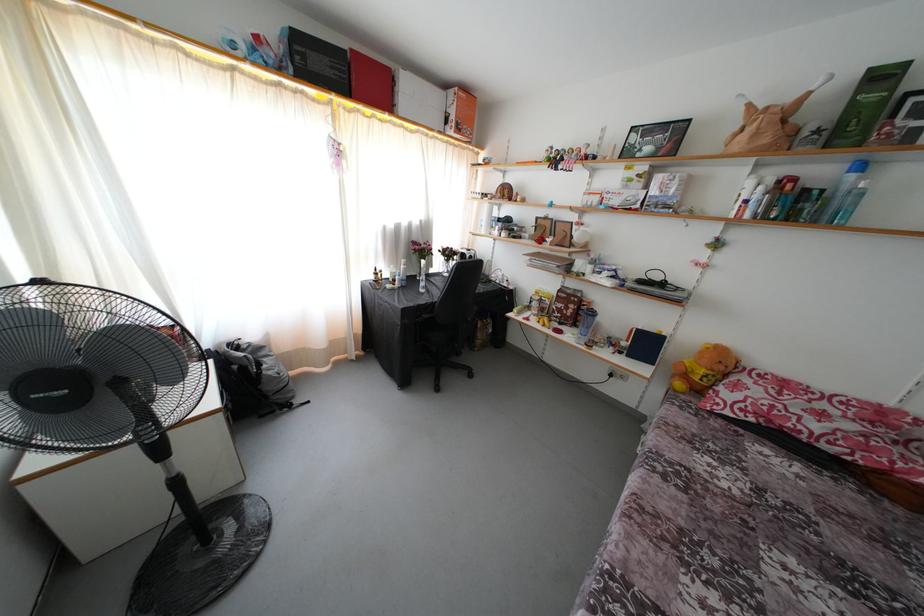
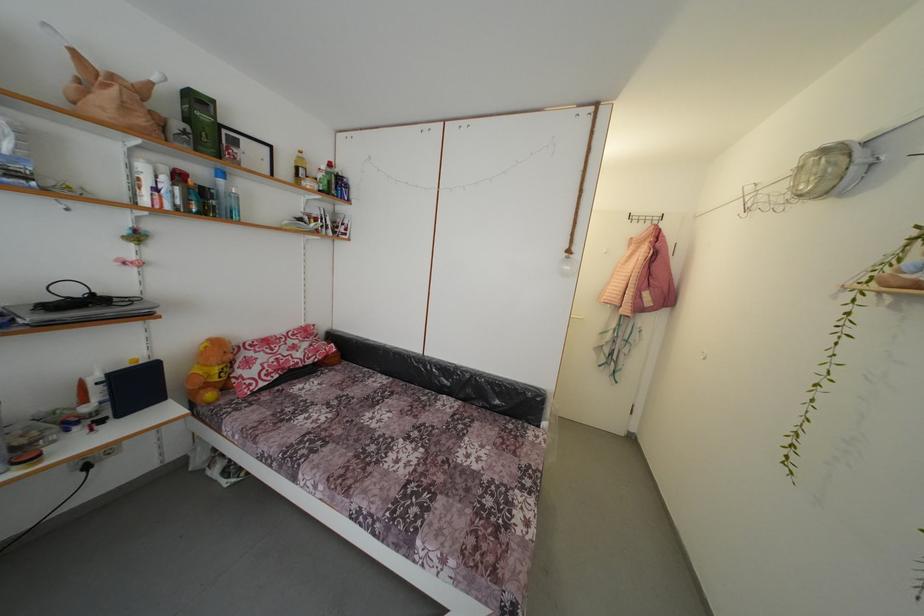
Based on the continuous images, in which direction is the camera rotating?

The rotation direction of the camera is right-down.